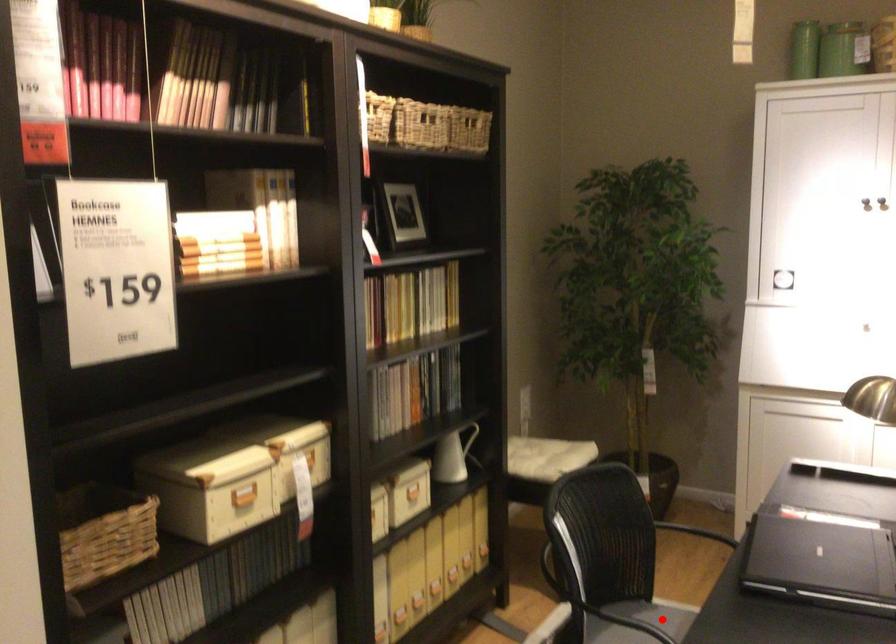
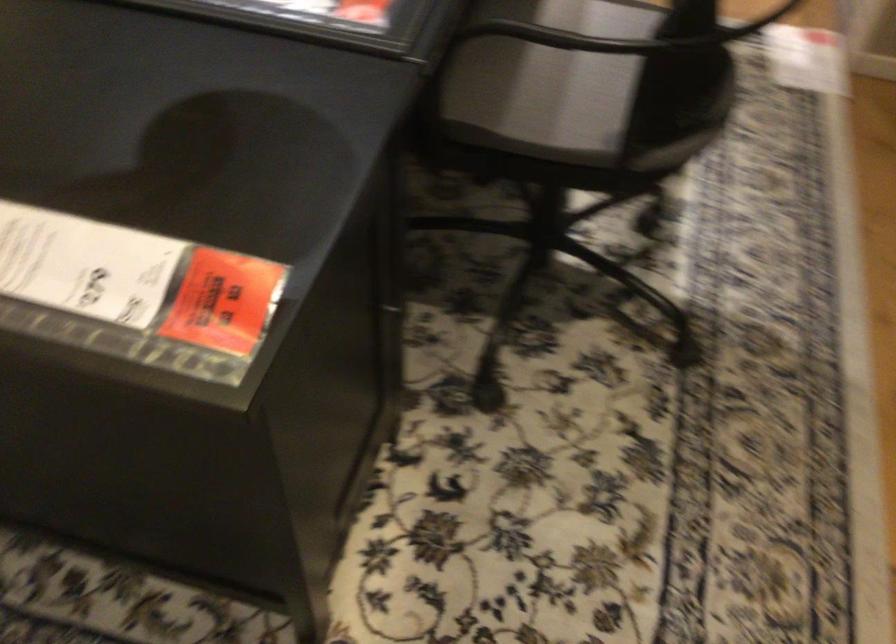
Question: I am providing you with two images of the same scene from different viewpoints. A red point is marked on the first image. Can you still see the location of the red point in image 2?

Choices:
 (A) Yes
 (B) No

Answer: (B)